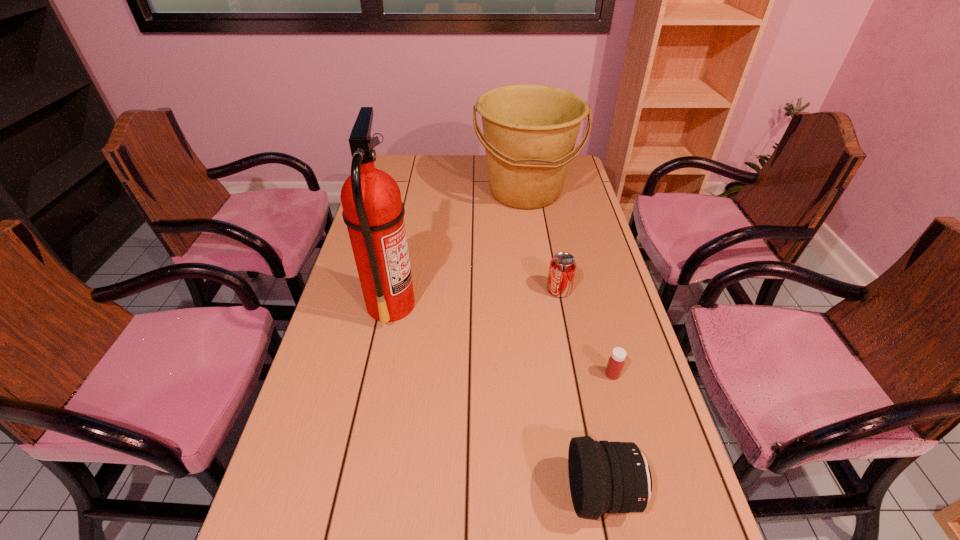
Find the location of a particular element. The image size is (960, 540). free spot between the telephoto lens and the second tallest object is located at coordinates (564, 342).

Find the location of a particular element. The height and width of the screenshot is (540, 960). vacant area between the nearest object and the bucket is located at coordinates (564, 342).

Identify the location of empty space that is in between the third shortest object and the fire extinguisher. The image size is (960, 540). (497, 399).

Where is `free space between the second tallest object and the fourth tallest object`? The height and width of the screenshot is (540, 960). free space between the second tallest object and the fourth tallest object is located at coordinates (542, 241).

Where is `blank region between the tallest object and the fourth farthest object`? blank region between the tallest object and the fourth farthest object is located at coordinates (502, 339).

In order to click on vacant region between the soda can and the second nearest object in this screenshot , I will do `click(586, 333)`.

Locate an element on the screen. This screenshot has width=960, height=540. unoccupied position between the nearest object and the fourth tallest object is located at coordinates (581, 392).

Where is `object that is the third nearest to the tallest object`? object that is the third nearest to the tallest object is located at coordinates tap(607, 477).

Locate which object is the closest to the medicine. Please provide its 2D coordinates. Your answer should be formatted as a tuple, i.e. [(x, y)], where the tuple contains the x and y coordinates of a point satisfying the conditions above.

[(607, 477)]

Image resolution: width=960 pixels, height=540 pixels. Identify the location of vacant region that satisfies the following two spatial constraints: 1. on the side of the bucket with the handle; 2. on the left side of the shortest object. (552, 374).